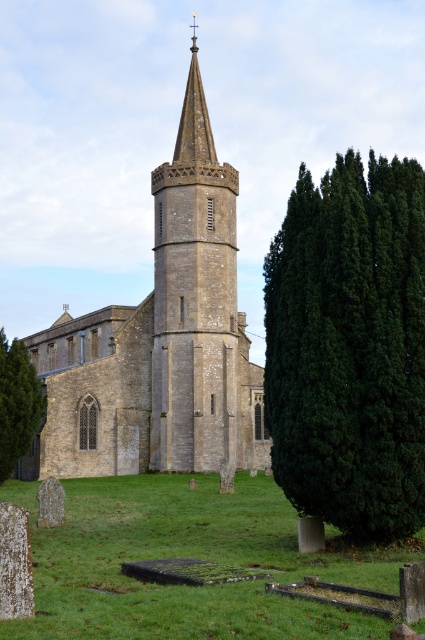
You are standing at the white textured stone gravestone at lower left and want to walk directly to the green textured tree at center right. How far will you have to walk?

The distance between the white textured stone gravestone at lower left and the green textured tree at center right is 15.83 meters, so you will have to walk 15.83 meters.

You are standing at the entrance of the stone church at center and want to visit the white textured stone gravestone at lower left. Which direction should you walk to reach the gravestone?

Since the stone church at center is positioned over the white textured stone gravestone at lower left, you should walk downward from the stone church at center to reach the white textured stone gravestone at lower left.

You are standing at the entrance of the historic stone church and want to take a photo of the green textured tree at center right. Based on its position, which direction should you face to capture it in your shot?

The green textured tree at center right is located at point coordinates, so you should face towards the center right direction to capture it in your shot.